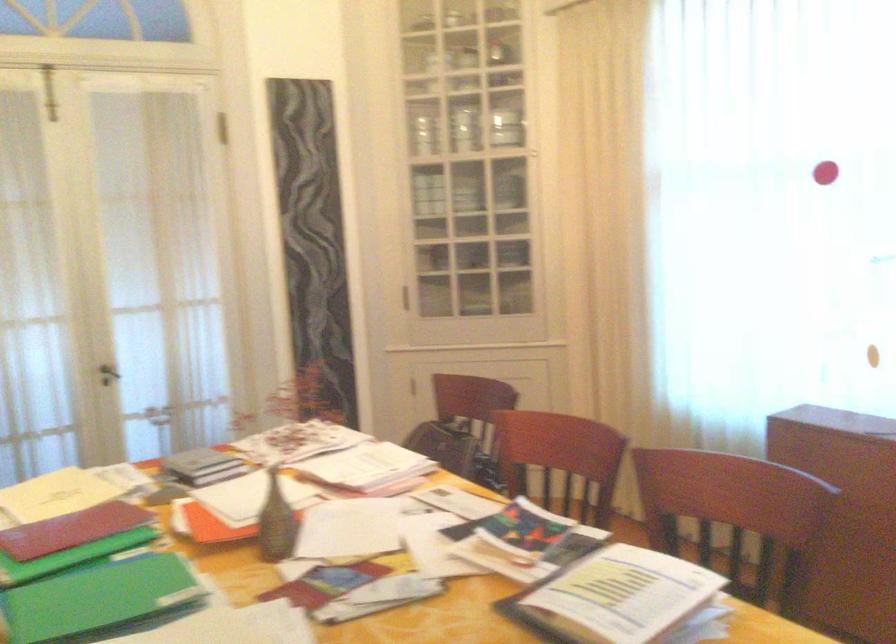
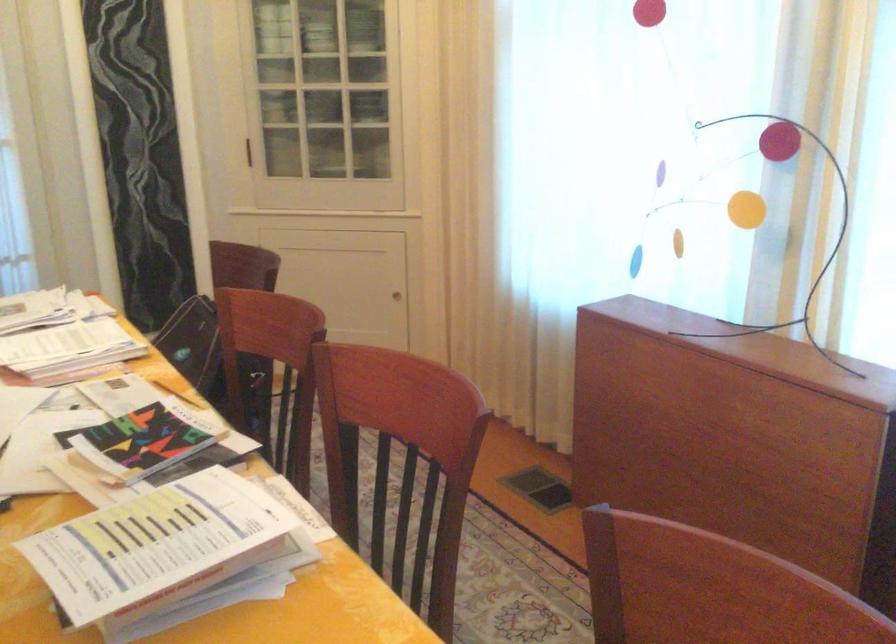
Which direction would the cameraman need to move to produce the second image?

The cameraman moved toward right, forward.